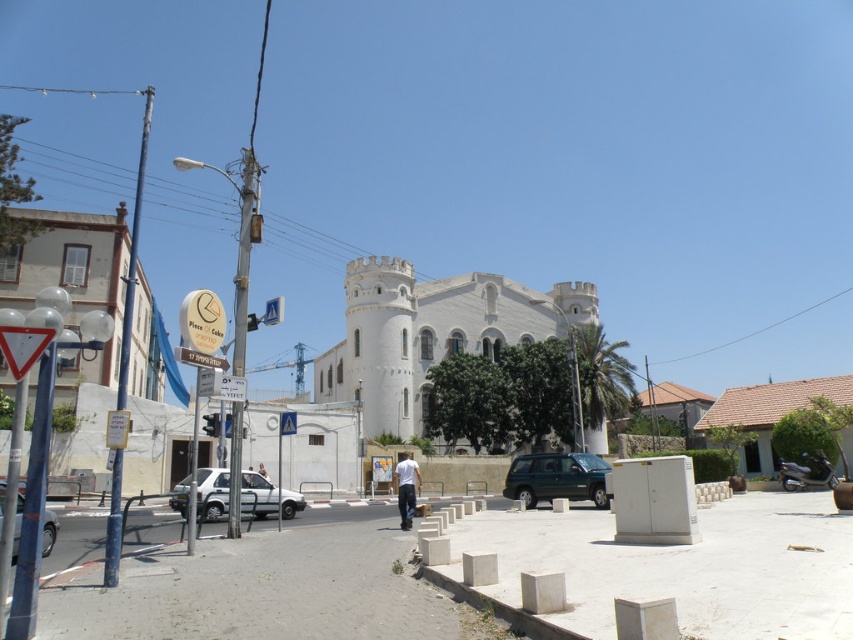
You are a pedestrian standing at the edge of the paved area and want to cross to the other side. There is a green matte suv at center and a light brown leather jacket at center in your path. Which object should you avoid first to safely navigate around them?

The green matte suv at center is in front of the light brown leather jacket at center, so you should avoid the green matte suv at center first to safely navigate around them.

Based on the provided scene description, where is the green matte suv at center located in the image?

The green matte suv at center is located at point (x=556, y=477).

You are a delivery person trying to park your green matte suv at center in a space that can only accommodate vehicles narrower than the light brown leather jacket at center. Can your suv fit in the space?

The green matte suv at center is wider than the light brown leather jacket at center. Since the parking space can only accommodate vehicles narrower than the jacket, the suv cannot fit in the space.